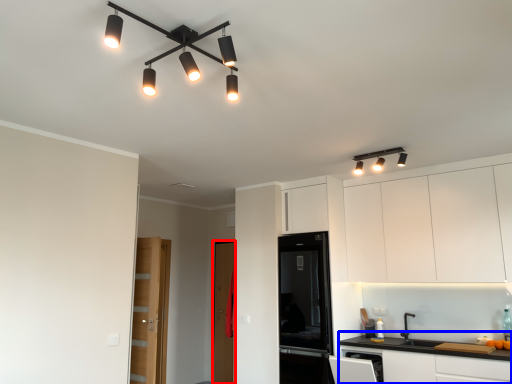
Question: Among these objects, which one is farthest to the camera, glass door (highlighted by a red box) or cabinetry (highlighted by a blue box)?

Choices:
 (A) glass door
 (B) cabinetry

Answer: (A)